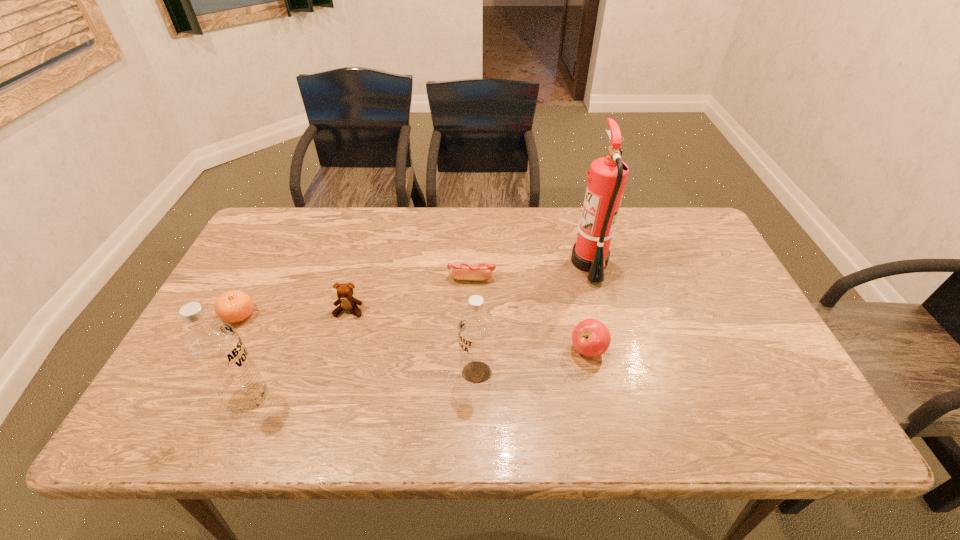
Find the location of `the left vodka`. the left vodka is located at coordinates (215, 348).

This screenshot has height=540, width=960. I want to click on the taller vodka, so (x=215, y=348).

Locate an element on the screen. The height and width of the screenshot is (540, 960). the right vodka is located at coordinates (476, 330).

The image size is (960, 540). Find the location of `the shorter vodka`. the shorter vodka is located at coordinates (476, 330).

You are a GUI agent. You are given a task and a screenshot of the screen. Output one action in this format:
    pyautogui.click(x=<x>, y=<y>)
    Task: Click on the fire extinguisher
    The width and height of the screenshot is (960, 540).
    Given the screenshot: What is the action you would take?
    pyautogui.click(x=607, y=177)

Where is `sausage`? sausage is located at coordinates (461, 271).

At what (x,y) coordinates should I click in order to perform the action: click on teddy bear. Please return your answer as a coordinate pair (x, y). Looking at the image, I should click on (345, 291).

This screenshot has width=960, height=540. I want to click on the sixth tallest object, so click(x=233, y=306).

Locate an element on the screen. The width and height of the screenshot is (960, 540). the leftmost object is located at coordinates (233, 306).

This screenshot has width=960, height=540. I want to click on apple, so click(590, 337).